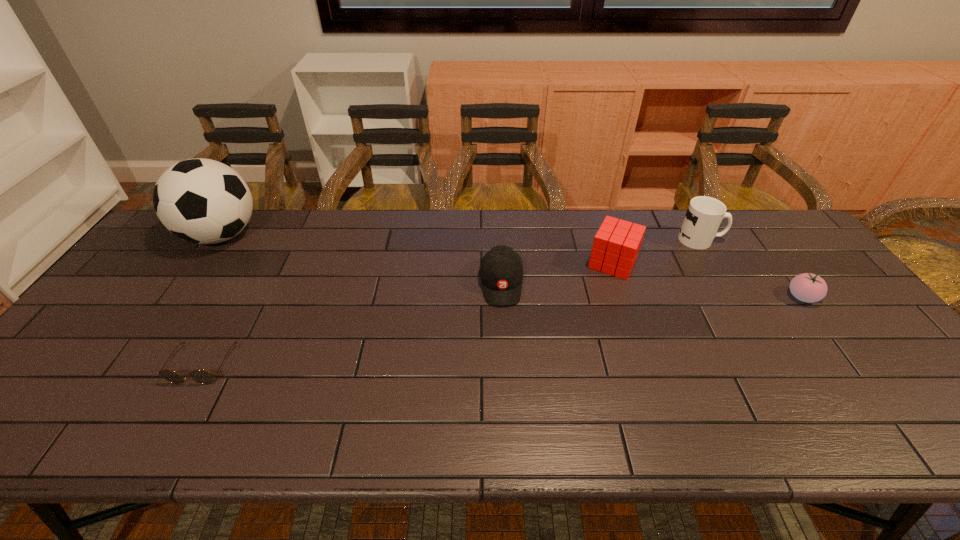
You are a GUI agent. You are given a task and a screenshot of the screen. Output one action in this format:
    pyautogui.click(x=<x>, y=<y>)
    Task: Click on the tallest object
    This screenshot has height=540, width=960.
    Given the screenshot: What is the action you would take?
    pyautogui.click(x=203, y=201)

Where is `mug`? mug is located at coordinates (704, 215).

The image size is (960, 540). In order to click on cube in this screenshot , I will do `click(616, 245)`.

Locate an element on the screen. The width and height of the screenshot is (960, 540). baseball cap is located at coordinates (501, 271).

Image resolution: width=960 pixels, height=540 pixels. Identify the location of the fourth tallest object. (501, 271).

Image resolution: width=960 pixels, height=540 pixels. What are the coordinates of `the rightmost object` in the screenshot? It's located at (807, 287).

You are a GUI agent. You are given a task and a screenshot of the screen. Output one action in this format:
    pyautogui.click(x=<x>, y=<y>)
    Task: Click on the tomato
    The image size is (960, 540).
    Given the screenshot: What is the action you would take?
    pyautogui.click(x=807, y=287)

The height and width of the screenshot is (540, 960). In order to click on the nearest object in this screenshot , I will do `click(199, 376)`.

The width and height of the screenshot is (960, 540). I want to click on sunglasses, so click(199, 376).

Where is `vacant position located on the front of the tallest object`? The image size is (960, 540). vacant position located on the front of the tallest object is located at coordinates (131, 366).